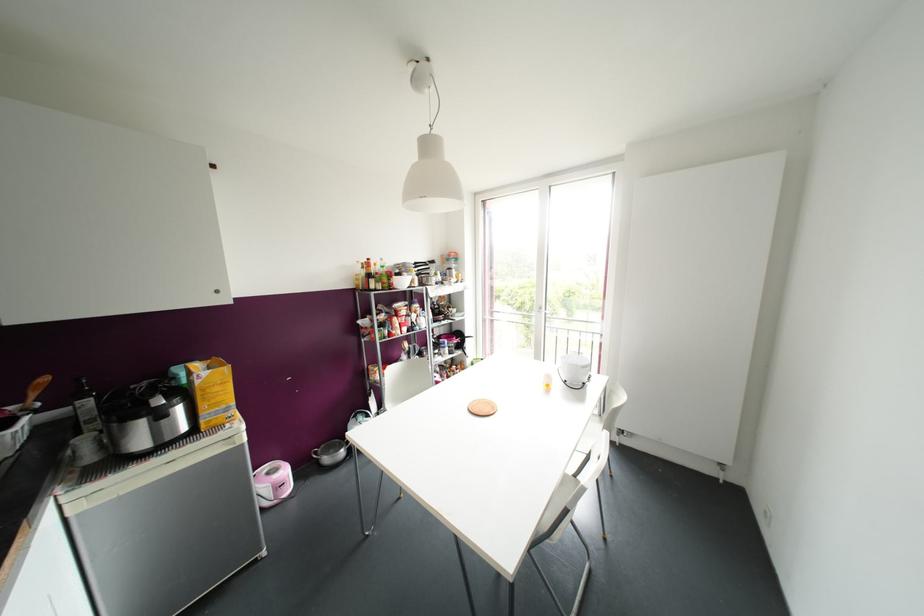
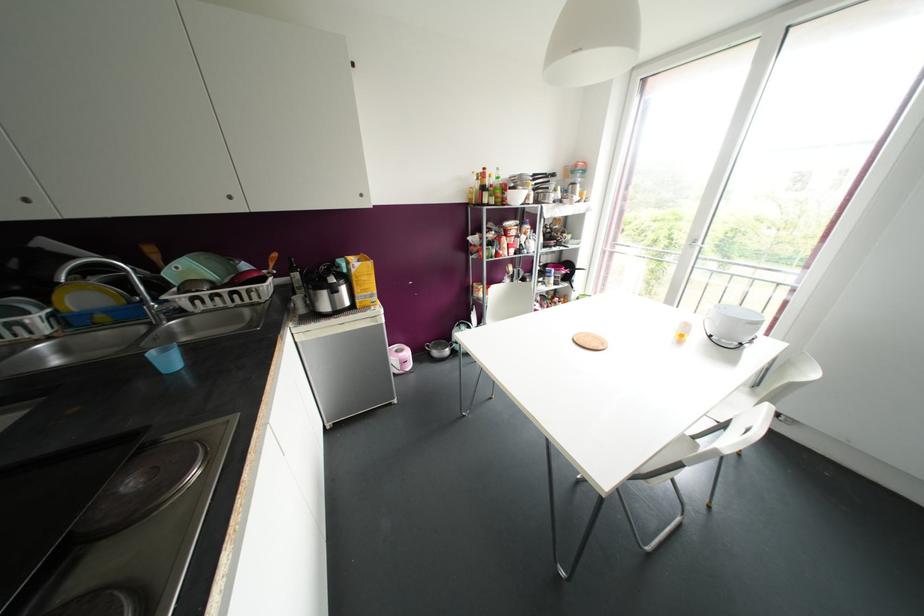
Locate, in the second image, the point that corresponds to (582,383) in the first image.

(740, 342)